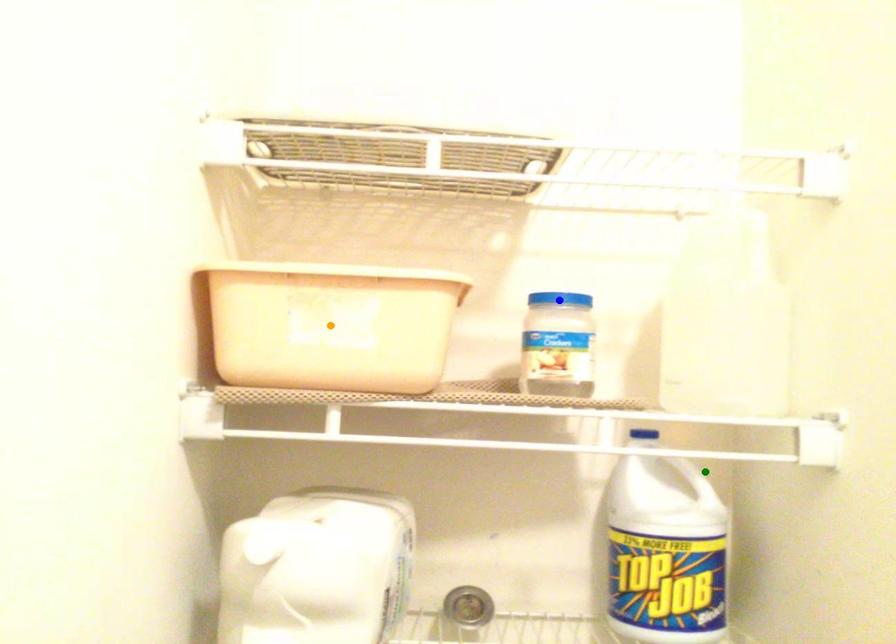
Order these from nearest to farthest:
blue point | green point | orange point

orange point < blue point < green point